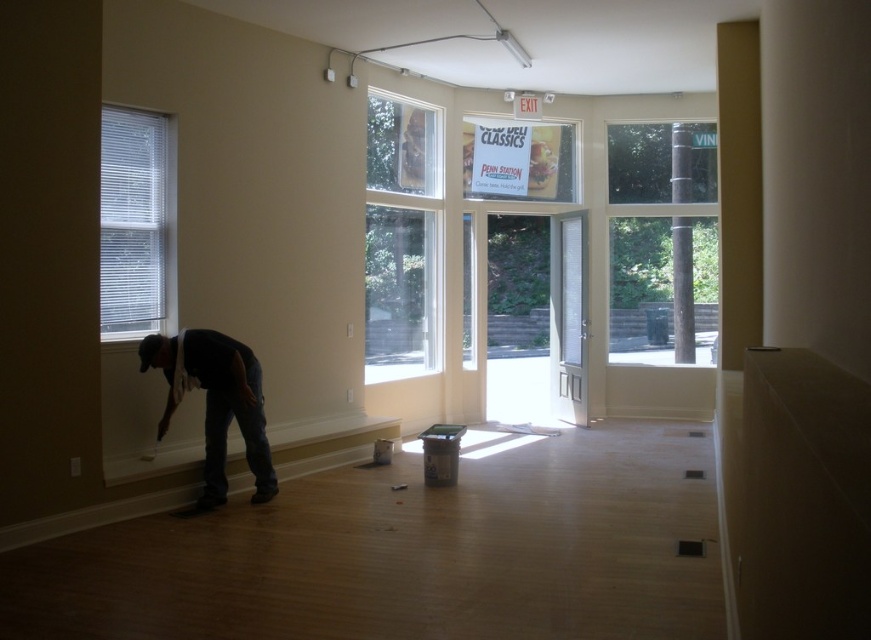
Question: Which point is farther from the camera taking this photo?

Choices:
 (A) (436, 202)
 (B) (211, 442)
 (C) (582, 365)
 (D) (679, 250)

Answer: (D)

Question: Which of these objects is positioned farthest from the clear glass window at center?

Choices:
 (A) clear glass door at center
 (B) clear glass window at upper right

Answer: (B)

Question: Is clear glass window at upper right bigger than clear glass window at center?

Choices:
 (A) no
 (B) yes

Answer: (A)

Question: Is clear glass window at center thinner than clear glass door at center?

Choices:
 (A) no
 (B) yes

Answer: (B)

Question: Which of the following is the closest to the observer?

Choices:
 (A) click(x=230, y=346)
 (B) click(x=149, y=161)
 (C) click(x=424, y=364)

Answer: (A)

Question: Does clear glass window at upper right appear on the right side of clear glass door at center?

Choices:
 (A) yes
 (B) no

Answer: (A)